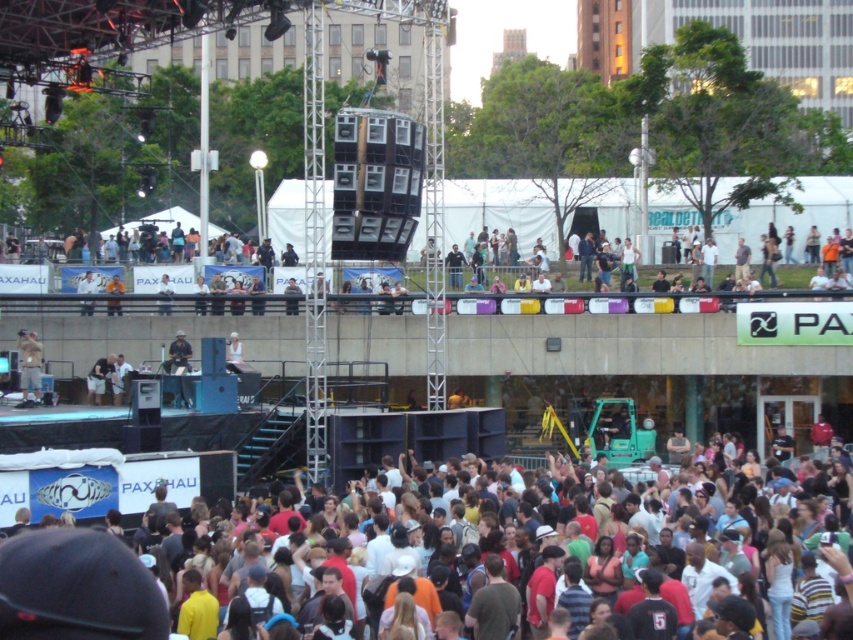
Question: Can you confirm if multicolored casual attire at lower center is thinner than light brown leather jacket at lower left?

Choices:
 (A) no
 (B) yes

Answer: (A)

Question: Is multicolored casual attire at lower center positioned behind light brown leather jacket at lower left?

Choices:
 (A) no
 (B) yes

Answer: (A)

Question: Can you confirm if multicolored casual attire at lower center is wider than light brown leather jacket at lower left?

Choices:
 (A) yes
 (B) no

Answer: (A)

Question: Which object appears closest to the camera in this image?

Choices:
 (A) light brown leather jacket at center
 (B) multicolored casual attire at lower center
 (C) light brown leather jacket at lower left

Answer: (B)

Question: Which object is positioned farthest from the light brown leather jacket at lower left?

Choices:
 (A) multicolored casual attire at lower center
 (B) light brown leather jacket at center

Answer: (A)

Question: Which of the following is the closest to the observer?

Choices:
 (A) light brown leather jacket at center
 (B) light brown leather jacket at lower left

Answer: (B)